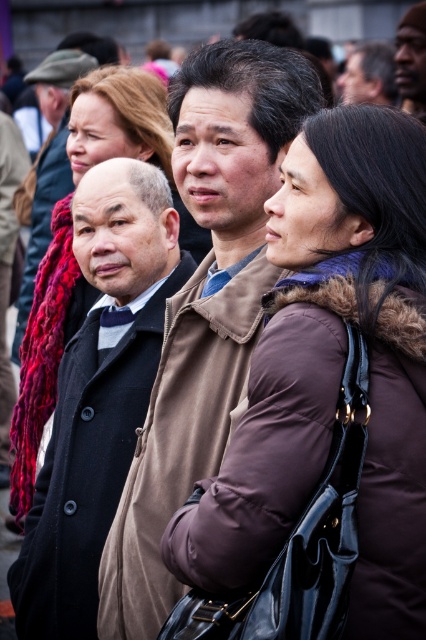
You are a photographer trying to capture a clear photo of the dark brown leather jacket at upper right. However, the brown matte jacket at center is blocking your view. Can you move around to the left side to get an unobstructed shot?

The brown matte jacket at center is in front of the dark brown leather jacket at upper right, so moving to the left side might allow you to see around or behind the brown matte jacket at center to capture the dark brown leather jacket at upper right without obstruction.

You are organizing a clothing donation drive and need to decide which items can fit into a small donation box. The box can only accommodate items up to 15 inches in width. You have the purple fuzzy scarf at center and the dark brown leather jacket at upper right. Based on their sizes, which item is more likely to fit into the box?

The dark brown leather jacket at upper right is more likely to fit into the box since its width is smaller than the purple fuzzy scarf at center, which exceeds the 15 inches limit.

Based on the scene description, which of the two jackets, the brown matte jacket at center or the dark brown leather jacket at upper right, is taller?

The brown matte jacket at center is taller than the dark brown leather jacket at upper right according to the description.